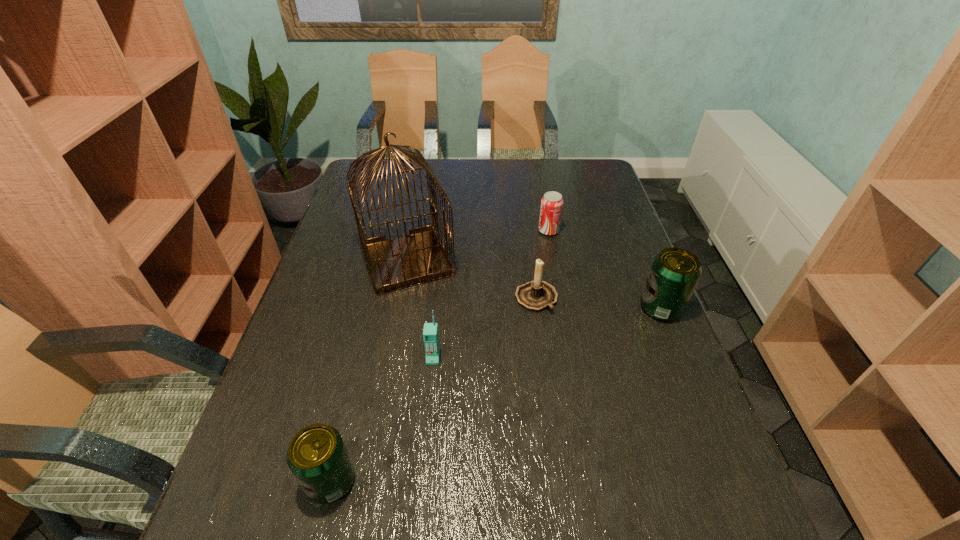
Where is `the nearer beer can`? The height and width of the screenshot is (540, 960). the nearer beer can is located at coordinates (317, 456).

The width and height of the screenshot is (960, 540). Identify the location of the nearest object. (317, 456).

Find the location of a particular element. the right beer can is located at coordinates (675, 272).

The image size is (960, 540). What are the coordinates of `the farther beer can` in the screenshot? It's located at (675, 272).

Identify the location of birdcage. (417, 258).

Find the location of a particular element. This screenshot has height=540, width=960. soda can is located at coordinates (551, 208).

Locate an element on the screen. Image resolution: width=960 pixels, height=540 pixels. candle holder is located at coordinates (536, 295).

At what (x,y) coordinates should I click in order to perform the action: click on the second nearest object. Please return your answer as a coordinate pair (x, y). The width and height of the screenshot is (960, 540). Looking at the image, I should click on (430, 332).

Locate an element on the screen. The width and height of the screenshot is (960, 540). free space located 0.130m on the right of the shorter beer can is located at coordinates (425, 481).

Identify the location of free region located 0.330m on the front of the rightmost object. (719, 452).